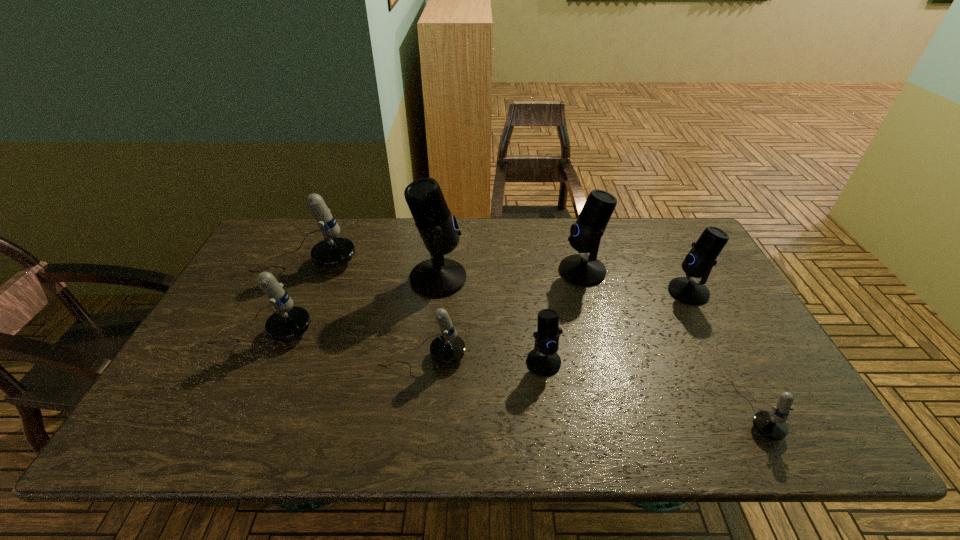
The image size is (960, 540). Find the location of `the nearest white microphone`. the nearest white microphone is located at coordinates (771, 425).

The width and height of the screenshot is (960, 540). In order to click on the rightmost white microphone in this screenshot , I will do `click(771, 425)`.

Locate an element on the screen. The height and width of the screenshot is (540, 960). vacant area located 0.290m on the stand of the tallest object is located at coordinates (563, 278).

Find the location of a particular element. Image resolution: width=960 pixels, height=540 pixels. vacant region located on the stand of the sixth object from left to right is located at coordinates (x=540, y=271).

Find the location of a particular element. The height and width of the screenshot is (540, 960). free space located 0.360m on the stand of the sixth object from left to right is located at coordinates (442, 271).

Locate an element on the screen. vacant space located on the stand of the sixth object from left to right is located at coordinates (439, 271).

The image size is (960, 540). What are the coordinates of `vacant region located on the right of the biggest white microphone` in the screenshot? It's located at (449, 262).

Find the location of `free space located on the stand of the third biggest black microphone`. free space located on the stand of the third biggest black microphone is located at coordinates (587, 292).

Where is `vacant space situated on the stand of the third biggest black microphone`? This screenshot has height=540, width=960. vacant space situated on the stand of the third biggest black microphone is located at coordinates (535, 292).

What are the coordinates of `vacant space located on the stand of the third biggest black microphone` in the screenshot? It's located at (573, 292).